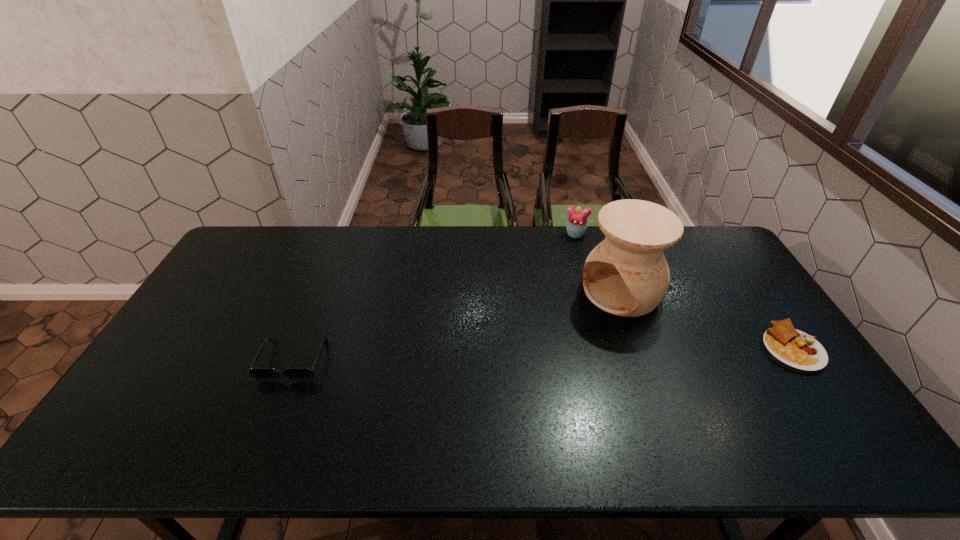
Identify the location of the third tallest object. Image resolution: width=960 pixels, height=540 pixels. (258, 373).

Where is `the leftmost object`? The image size is (960, 540). the leftmost object is located at coordinates (258, 373).

Where is `the rightmost object`? the rightmost object is located at coordinates (x=791, y=348).

At what (x,y) coordinates should I click in order to perform the action: click on the shortest object. Please return your answer as a coordinate pair (x, y). Looking at the image, I should click on (791, 348).

Find the location of a particular element. cupcake is located at coordinates (576, 226).

At what (x,y) coordinates should I click in order to perform the action: click on the second tallest object. Please return your answer as a coordinate pair (x, y). Looking at the image, I should click on (576, 226).

The image size is (960, 540). Find the location of `the second farthest object`. the second farthest object is located at coordinates (627, 274).

At what (x,y) coordinates should I click in order to perform the action: click on pottery. Please return your answer as a coordinate pair (x, y). Looking at the image, I should click on (627, 274).

This screenshot has height=540, width=960. I want to click on free space located on the front-facing side of the second shortest object, so click(276, 406).

Where is `blank space located on the left of the omelet`? blank space located on the left of the omelet is located at coordinates (702, 348).